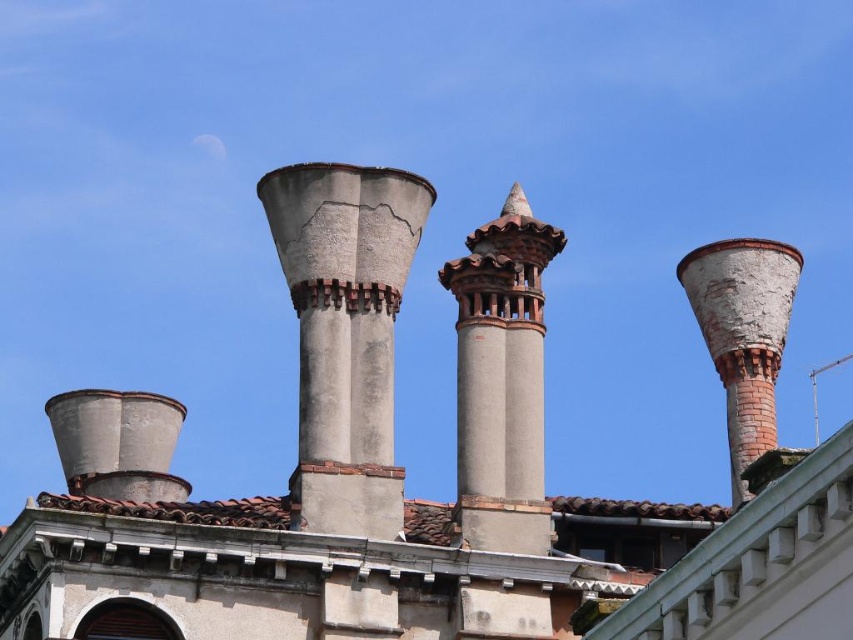
You are an architect reviewing the roof layout. You need to locate the terracotta textured chimney at center. What are its coordinates?

The terracotta textured chimney at center is located at point (x=502, y=380).

From the picture: You are an architect reviewing the roof design and notice the gray concrete chimney at center and the terracotta textured chimney at center. Which one is positioned to the left side from your viewpoint?

The gray concrete chimney at center is positioned to the left of the terracotta textured chimney at center.